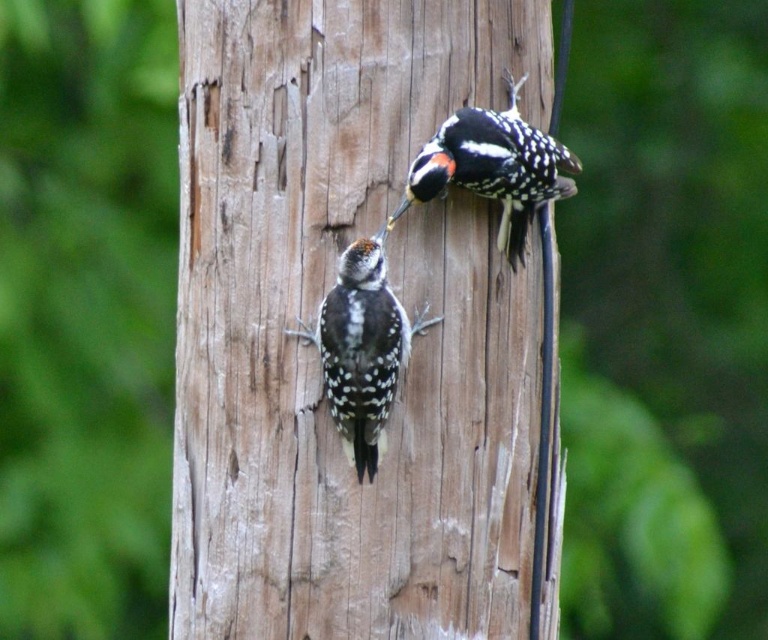
Is speckled feathered woodpecker at center further to the viewer compared to speckled brown woodpecker at upper center?

No, it is in front of speckled brown woodpecker at upper center.

Between speckled feathered woodpecker at center and speckled brown woodpecker at upper center, which one is positioned higher?

speckled brown woodpecker at upper center

Is point (366, 413) positioned behind point (568, 195)?

No, it is in front of (568, 195).

Where is `speckled feathered woodpecker at center`? speckled feathered woodpecker at center is located at coordinates (361, 349).